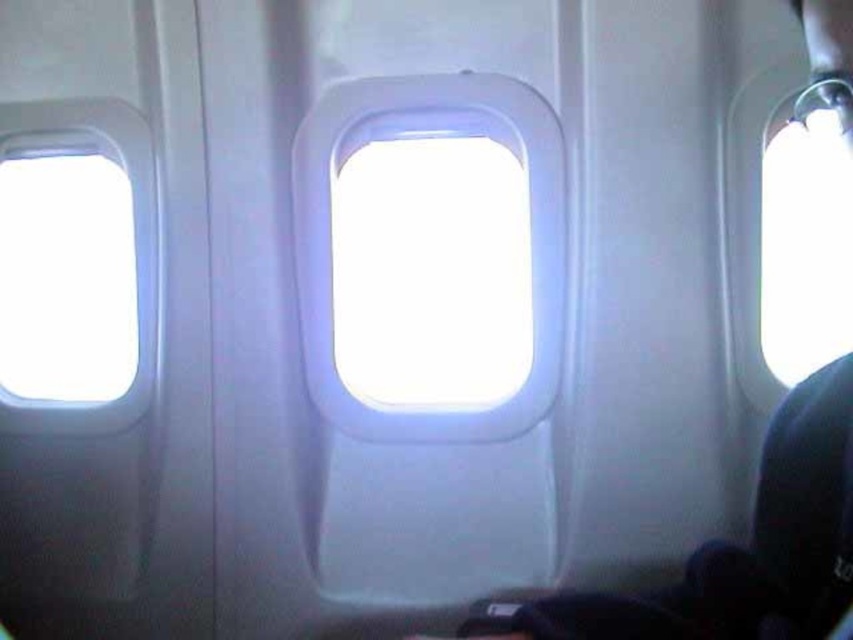
Can you confirm if transparent plastic airplane window at center is positioned to the right of transparent glass airplane window at left?

Correct, you'll find transparent plastic airplane window at center to the right of transparent glass airplane window at left.

What do you see at coordinates (331, 248) in the screenshot? I see `transparent plastic airplane window at center` at bounding box center [331, 248].

Measure the distance between point (515, 113) and camera.

A distance of 1.35 meters exists between point (515, 113) and camera.

Find the location of a particular element. This screenshot has width=853, height=640. transparent plastic airplane window at center is located at coordinates (331, 248).